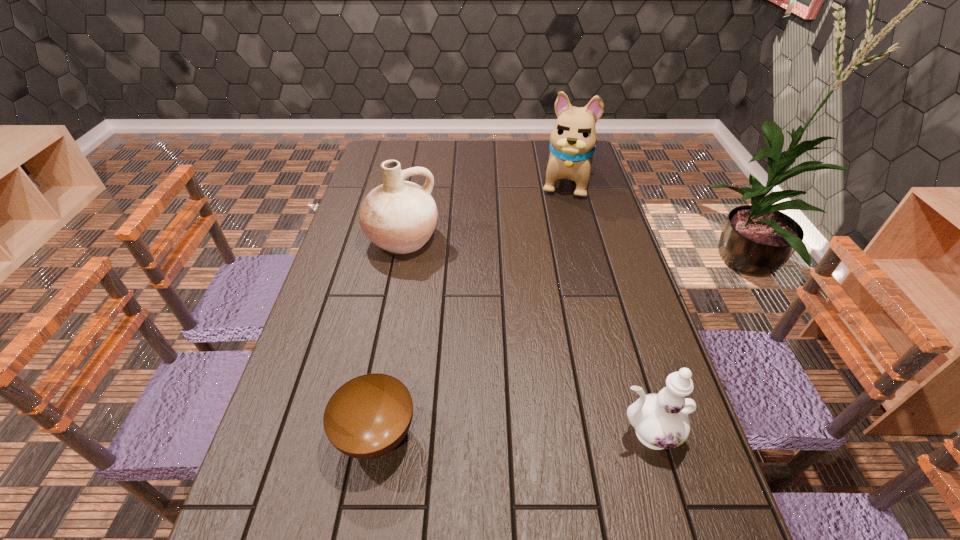
At what (x,y) coordinates should I click in order to perform the action: click on vacant position in the image that satisfies the following two spatial constraints: 1. on the front side of the chinaware; 2. at the spout of the tallest object. Please return your answer as a coordinate pair (x, y). The height and width of the screenshot is (540, 960). Looking at the image, I should click on (628, 433).

Locate an element on the screen. The height and width of the screenshot is (540, 960). free space that satisfies the following two spatial constraints: 1. on the back side of the chinaware; 2. at the spout of the bowl is located at coordinates (376, 433).

In order to click on vacant space that satisfies the following two spatial constraints: 1. on the back side of the chinaware; 2. at the spout of the bowl in this screenshot , I will do `click(376, 433)`.